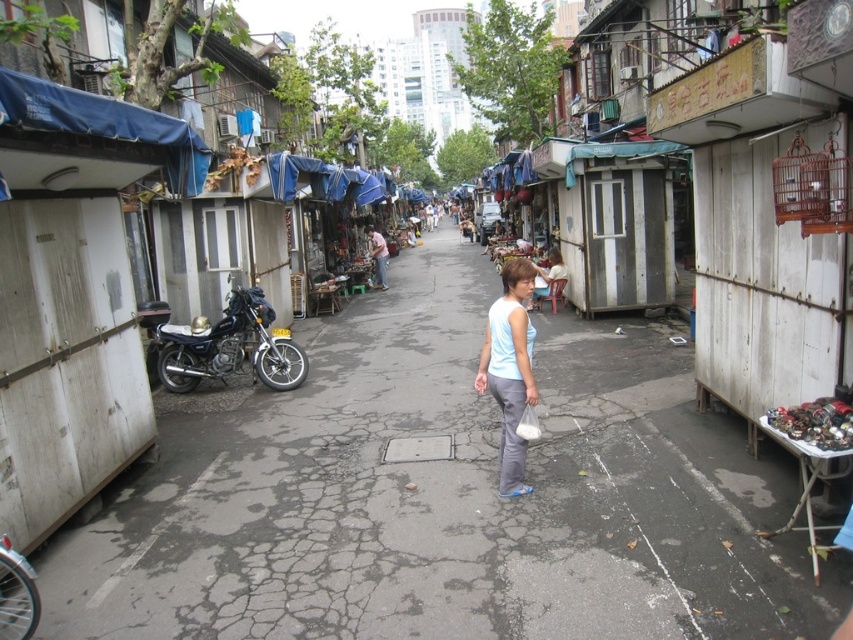
Question: Among these points, which one is nearest to the camera?

Choices:
 (A) (709, 618)
 (B) (506, 294)
 (C) (257, 310)

Answer: (A)

Question: Does shiny blue motorcycle at left appear on the left side of light blue fabric at center?

Choices:
 (A) yes
 (B) no

Answer: (A)

Question: Observing the image, what is the correct spatial positioning of gray cracked pavement at center in reference to light blue fabric at center?

Choices:
 (A) right
 (B) left

Answer: (B)

Question: Which object is the farthest from the gray cracked pavement at center?

Choices:
 (A) light blue fabric at center
 (B) shiny blue motorcycle at left

Answer: (A)

Question: Estimate the real-world distances between objects in this image. Which object is closer to the shiny blue motorcycle at left?

Choices:
 (A) gray cracked pavement at center
 (B) light blue fabric at center

Answer: (A)

Question: Is gray cracked pavement at center in front of shiny blue motorcycle at left?

Choices:
 (A) yes
 (B) no

Answer: (A)